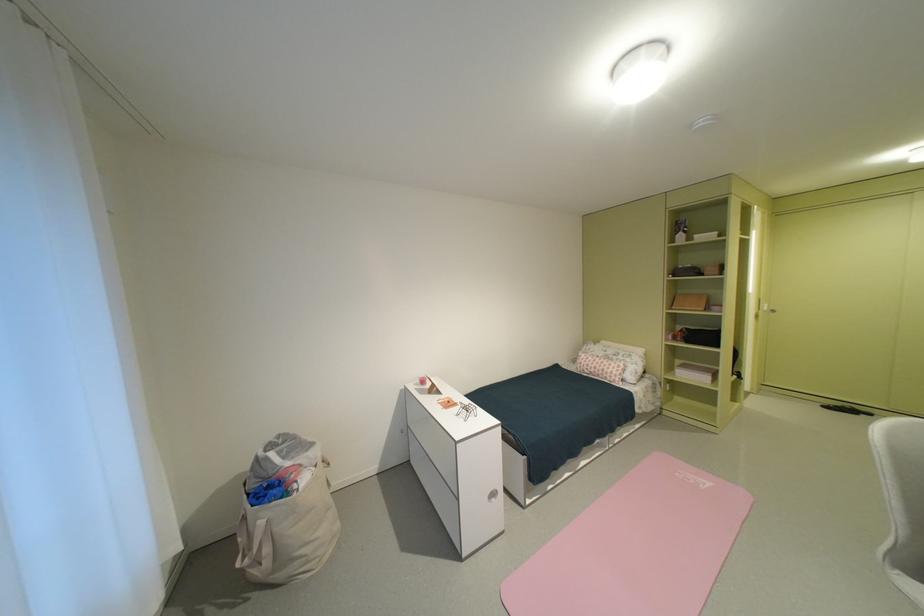
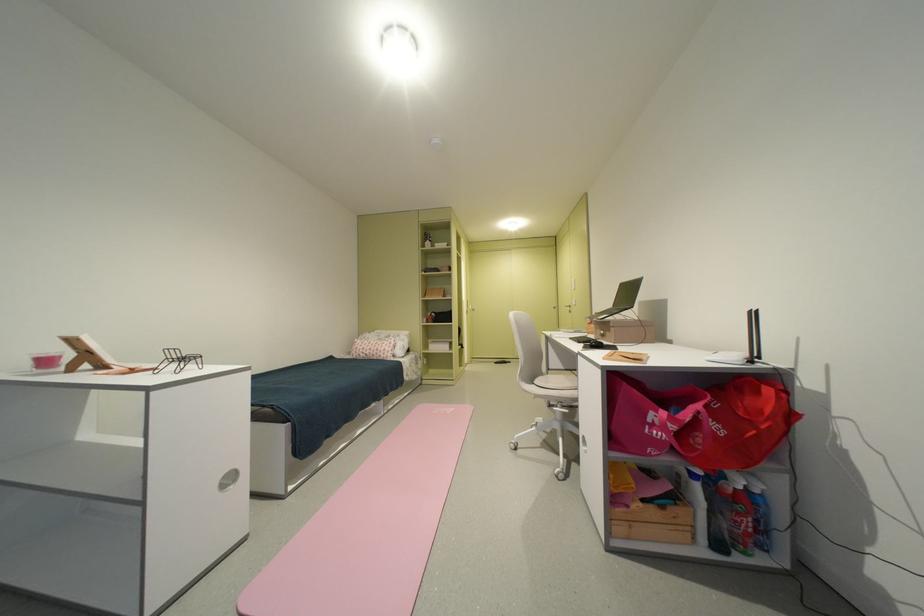
Find the pixel in the second image that matches the point at 686,476 in the first image.

(444, 413)